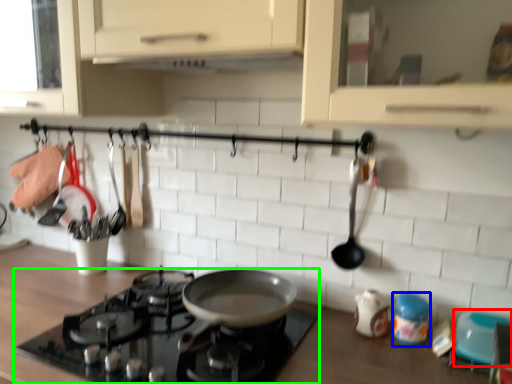
Question: Which is nearer to the appliance (highlighted by a red box)? appliance (highlighted by a blue box) or gas stove (highlighted by a green box).

Choices:
 (A) appliance
 (B) gas stove

Answer: (A)